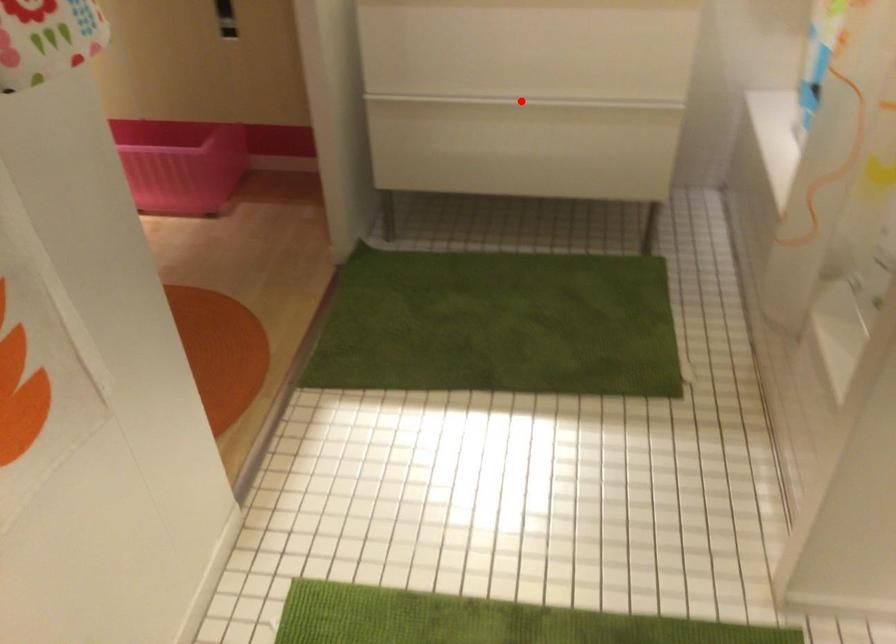
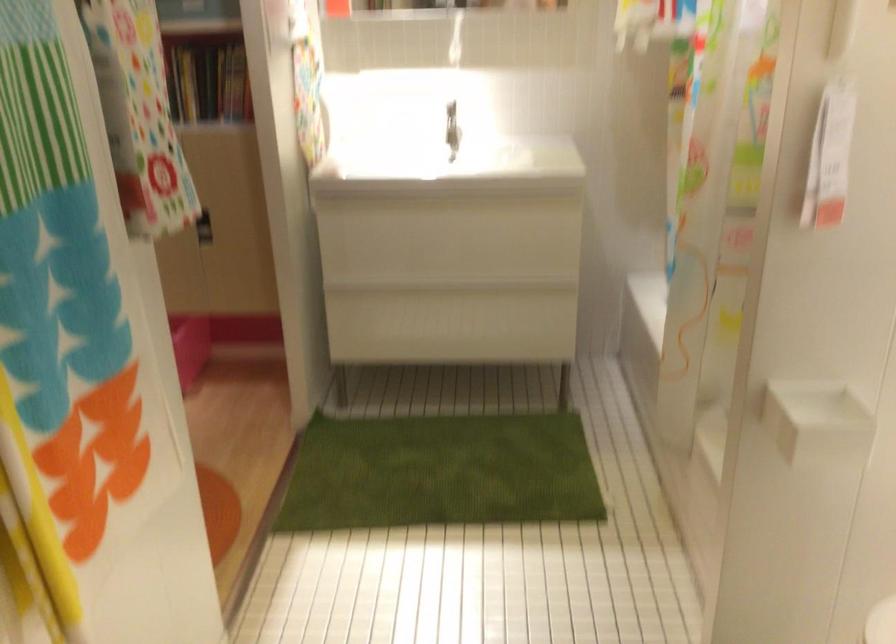
Question: A red point is marked in image1. In image2, is the corresponding 3D point closer to the camera or farther? Reply with the corresponding letter.

Choices:
 (A) The corresponding 3D point is closer.
 (B) The corresponding 3D point is farther.

Answer: (B)